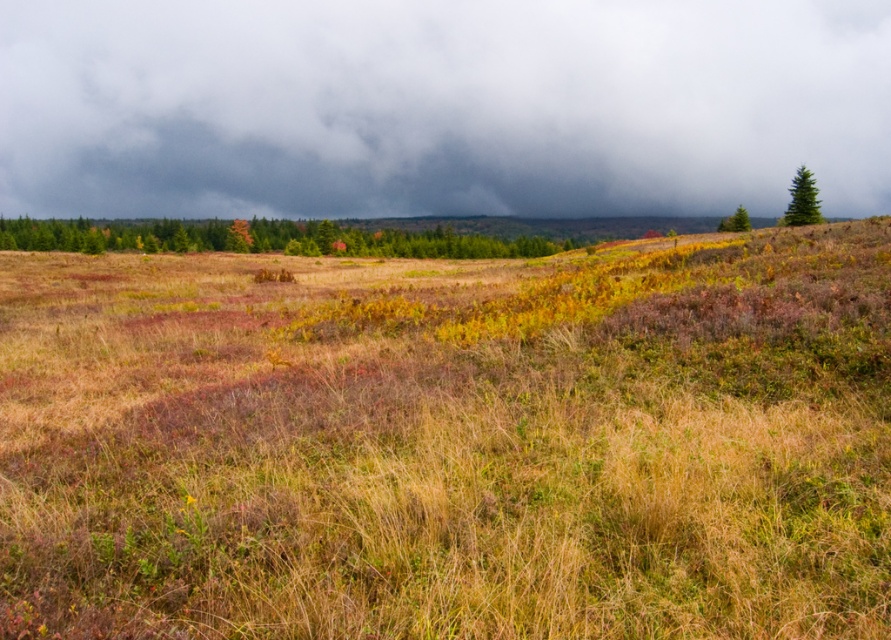
You are standing in the middle of the field of grasses and want to walk towards the green matte tree at upper right. Which direction should you walk to avoid the green matte tree at center?

To avoid the green matte tree at center, walk towards the green matte tree at upper right while staying to its left side, as the green matte tree at center is taller and may block the direct path.

You are an artist painting the landscape scene described. You need to decide which element, the gray cloudy sky at upper center or the green textured pine at upper right, requires more horizontal space on your canvas. Based on the scene description, which one should you allocate more width to?

The gray cloudy sky at upper center should be allocated more width on the canvas because its width surpasses that of the green textured pine at upper right according to the description.

You are standing in the field of grasses and want to walk towards both the green matte tree at center and the green matte tree at upper right. Which tree will you reach first?

You will reach the green matte tree at center first because it is closer to you than the green matte tree at upper right, which is further away.